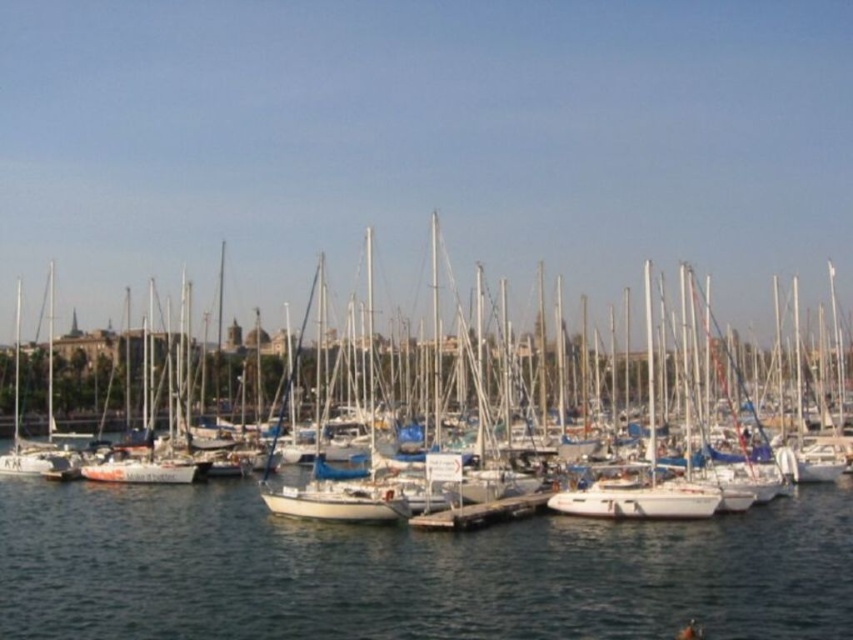
Which is behind, point (775, 593) or point (744, 417)?

Positioned behind is point (744, 417).

Between clear water at center and white matte sailboat at center, which one has less height?

clear water at center

What are the coordinates of `clear water at center` in the screenshot? It's located at (408, 572).

Can you confirm if white matte sailboat at center is positioned to the left of smooth concrete dock at center?

Yes, white matte sailboat at center is to the left of smooth concrete dock at center.

Does white matte sailboat at center appear over smooth concrete dock at center?

Indeed, white matte sailboat at center is positioned over smooth concrete dock at center.

You are a GUI agent. You are given a task and a screenshot of the screen. Output one action in this format:
    pyautogui.click(x=<x>, y=<y>)
    Task: Click on the white matte sailboat at center
    The image size is (853, 640).
    Given the screenshot: What is the action you would take?
    pyautogui.click(x=521, y=403)

Locate an element on the screen. The height and width of the screenshot is (640, 853). clear water at center is located at coordinates (408, 572).

Image resolution: width=853 pixels, height=640 pixels. What do you see at coordinates (408, 572) in the screenshot?
I see `clear water at center` at bounding box center [408, 572].

Which is in front, point (782, 602) or point (416, 524)?

Point (782, 602) is in front.

The image size is (853, 640). Identify the location of clear water at center. (408, 572).